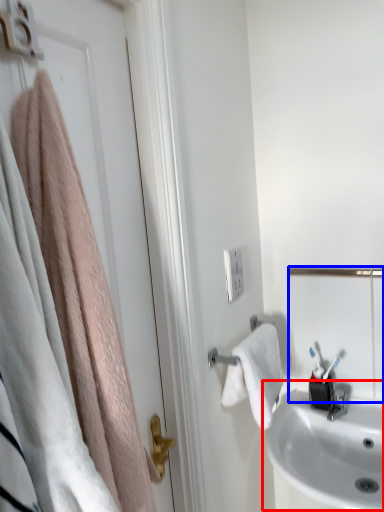
Question: Which object is further to the camera taking this photo, sink (highlighted by a red box) or mirror (highlighted by a blue box)?

Choices:
 (A) sink
 (B) mirror

Answer: (B)